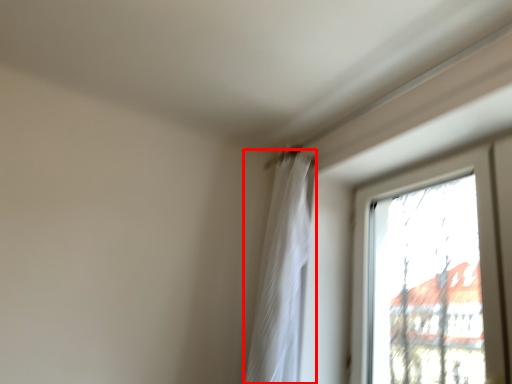
Question: From the image, what is the correct spatial relationship of curtain (annotated by the red box) in relation to window?

Choices:
 (A) right
 (B) left

Answer: (B)